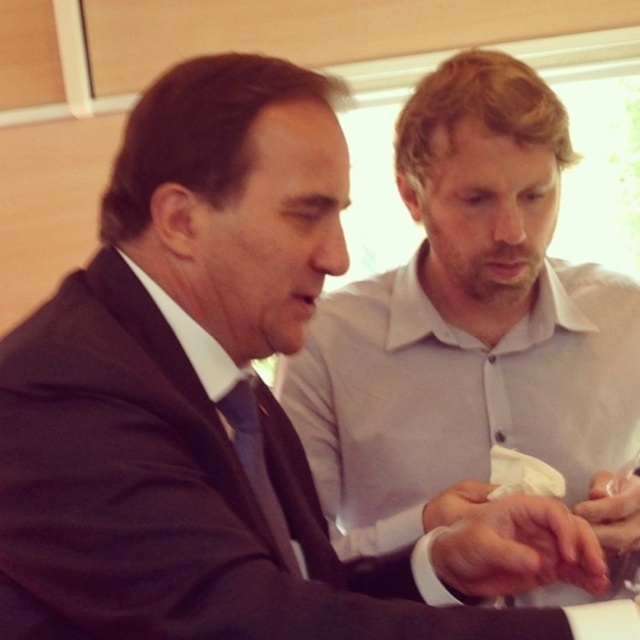
Question: Is dark blue suit at left bigger than white smooth skin at center?

Choices:
 (A) no
 (B) yes

Answer: (B)

Question: Which of these objects is positioned closest to the white matte hand at center?

Choices:
 (A) translucent plastic cup at center
 (B) white cotton shirt at center

Answer: (A)

Question: Does matte blue tie at center appear on the left side of translucent plastic cup at center?

Choices:
 (A) yes
 (B) no

Answer: (A)

Question: Which point is closer to the camera?

Choices:
 (A) (428, 528)
 (B) (598, 540)
 (C) (544, 596)
 (D) (536, 504)

Answer: (D)

Question: Does matte blue tie at center have a smaller size compared to translucent plastic cup at center?

Choices:
 (A) no
 (B) yes

Answer: (A)

Question: Which point is farther to the camera?

Choices:
 (A) (545, 566)
 (B) (611, 435)
 (C) (237, 380)
 (D) (477, 502)

Answer: (B)